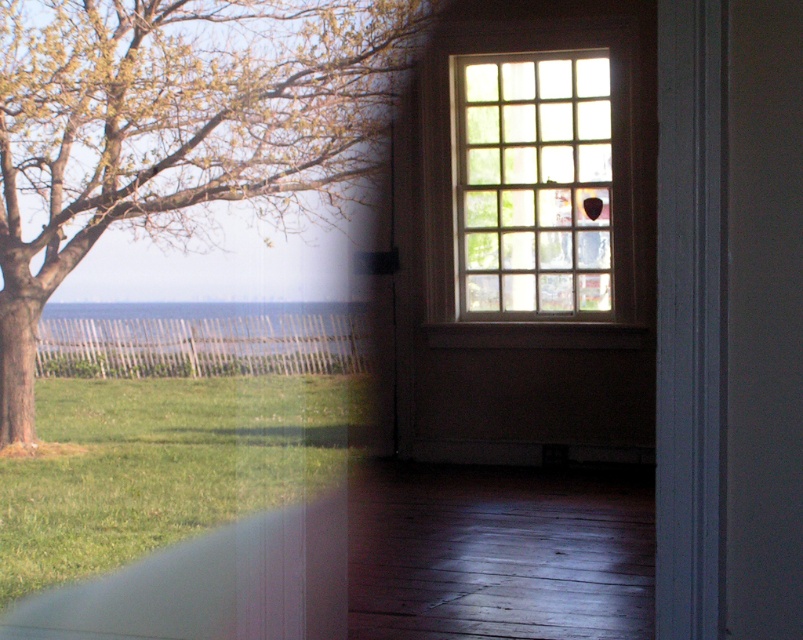
Is point (321, 150) farther from camera compared to point (196, 362)?

That is False.

Does green leafy tree at left have a lesser height compared to clear blue water at center?

In fact, green leafy tree at left may be taller than clear blue water at center.

Between point (325, 45) and point (223, 332), which one is positioned in front?

Point (325, 45) is more forward.

The height and width of the screenshot is (640, 803). In order to click on green leafy tree at left in this screenshot , I will do `click(173, 129)`.

Is green leafy tree at left to the right of clear glass window at center from the viewer's perspective?

Incorrect, green leafy tree at left is not on the right side of clear glass window at center.

Does green leafy tree at left have a greater width compared to clear glass window at center?

Incorrect, green leafy tree at left's width does not surpass clear glass window at center's.

Is point (68, 35) positioned before point (577, 212)?

Yes, it is.

Identify the location of green leafy tree at left. (173, 129).

Between clear glass window at center and clear blue water at center, which one is positioned lower?

clear blue water at center is lower down.

Between clear glass window at center and clear blue water at center, which one has less height?

Standing shorter between the two is clear blue water at center.

Which is behind, point (524, 113) or point (278, 349)?

The point (524, 113) is behind.

This screenshot has width=803, height=640. I want to click on clear glass window at center, so click(x=532, y=172).